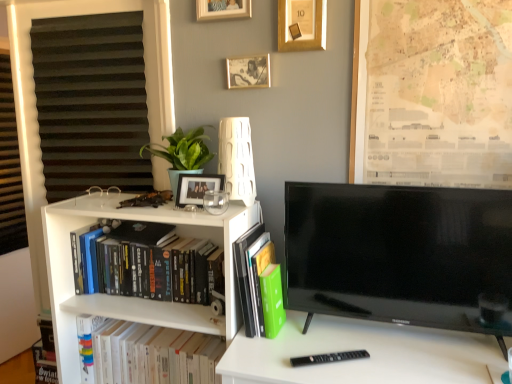
Find the location of a particular element. This screenshot has width=512, height=384. spots to the right of green matte book at center, the second book from the top is located at coordinates (313, 331).